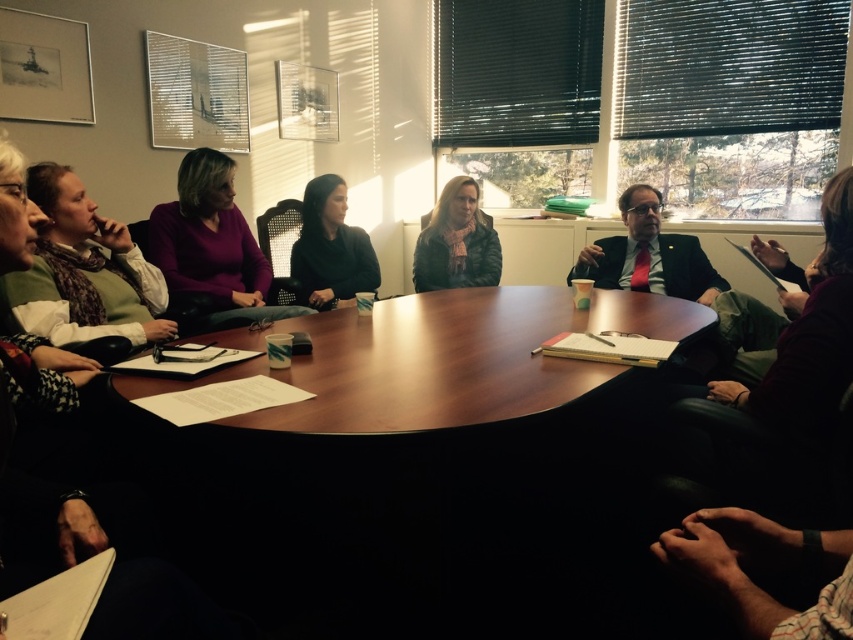
You are organizing a charity event and need to decide which sweater to donate based on their thickness. If the green sweater at left is thinner than the black matte sweater at center, which sweater would be more suitable for a winter donation?

The black matte sweater at center is thicker and more suitable for winter donation since it is thicker than the green sweater at left.

You are standing in front of the conference table and want to place a small plant between the two points labeled point (15, 296) and point (202, 224). Which point should the plant be closer to if you want it to be nearer to the viewer?

The plant should be placed closer to point (15, 296) because it is closer to the viewer than point (202, 224).

Based on the photo, you are organizing a charity event and need to decide which sweater to donate. The green sweater at left and the matte purple sweater at center are both available. Which sweater is more likely to fit a standard adult size?

The matte purple sweater at center is larger than the green sweater at left, so it is more likely to fit a standard adult size.